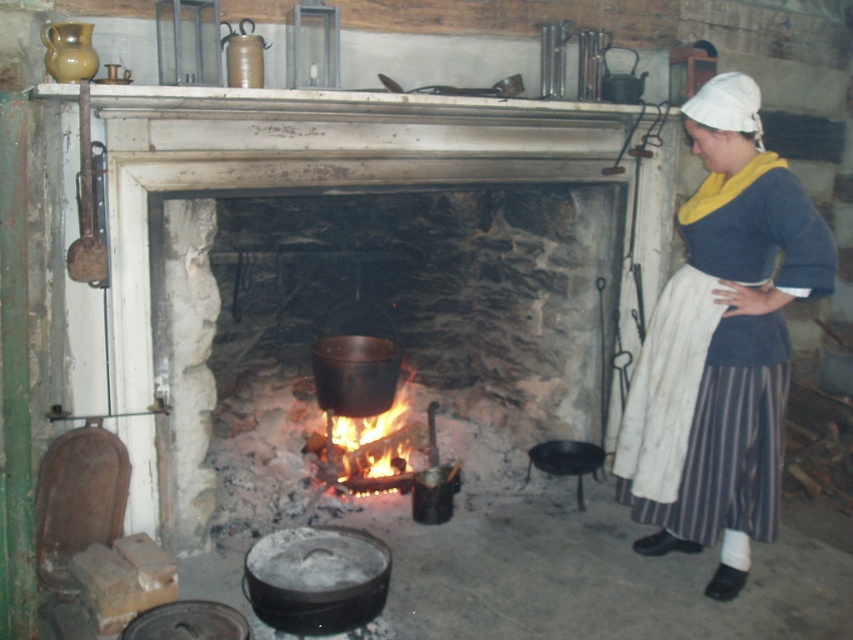
Is black cast iron pot at center smaller than flaming wood at center?

Incorrect, black cast iron pot at center is not smaller in size than flaming wood at center.

Who is more forward, (x=444, y=182) or (x=378, y=426)?

Point (x=444, y=182) is more forward.

Locate an element on the screen. Image resolution: width=853 pixels, height=640 pixels. black cast iron pot at center is located at coordinates (374, 269).

Between point (740, 275) and point (392, 440), which one is positioned behind?

The point (392, 440) is more distant.

Can you confirm if matte gray skirt at right is bigger than flaming wood at center?

Yes, matte gray skirt at right is bigger than flaming wood at center.

Is point (791, 214) less distant than point (306, 448)?

Yes, it is in front of point (306, 448).

What are the coordinates of `matte gray skirt at right` in the screenshot? It's located at click(722, 344).

Is black cast iron pot at center to the right of matte gray skirt at right from the viewer's perspective?

In fact, black cast iron pot at center is to the left of matte gray skirt at right.

Based on the photo, is black cast iron pot at center taller than matte gray skirt at right?

In fact, black cast iron pot at center may be shorter than matte gray skirt at right.

Find the location of a particular element. Image resolution: width=853 pixels, height=640 pixels. black cast iron pot at center is located at coordinates (374, 269).